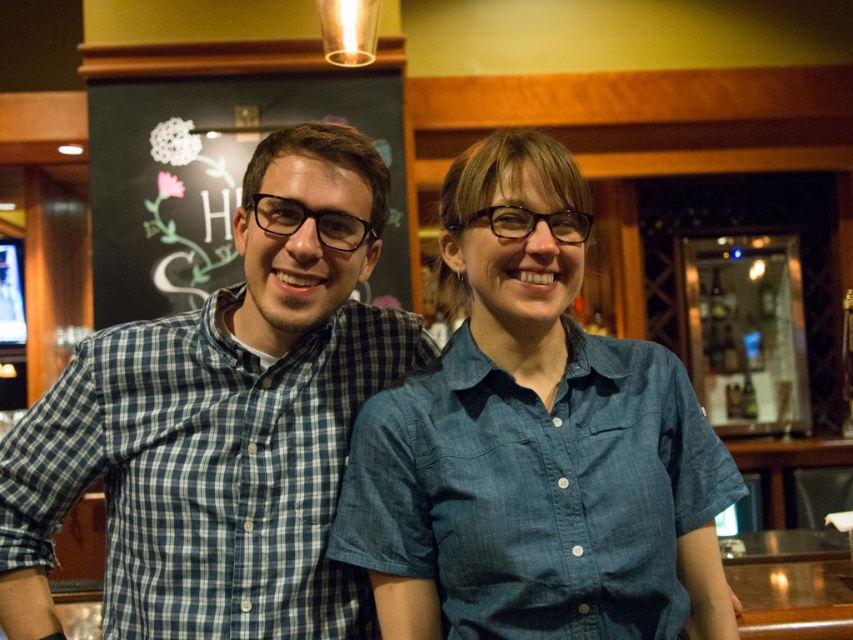
Looking at this image, you are a photographer trying to capture a group photo of the two people in the scene. The denim shirt at center is narrower than the black chalkboard at upper left. To ensure both subjects are framed properly, which object should you adjust your camera angle to focus on first?

The denim shirt at center is narrower than the black chalkboard at upper left, so you should focus on the denim shirt at center first to ensure proper framing since it requires less space in the frame.

Looking at this image, you are standing in the dining area and want to move from point A to point B. If point A is at point (x=393, y=595) and point B is at point (x=247, y=352), which direction should you move to get closer to point B?

To move from point A at (x=393, y=595) to point B at (x=247, y=352), you should move towards the left and downward since point A is in front of point B, meaning it is closer to the viewer. Moving left and down would align with the coordinates decreasing in both x and y directions.

You are standing in the casual dining or bar setting shown in the image. You need to move from your current position to a point that is behind both the point at coordinates (84, 412) and the point at (206, 102). Which point should you use as your reference to ensure you are positioned correctly?

To be behind both points, you should position yourself behind the point at coordinates (206, 102) because point (84, 412) is in front of it. Since point (206, 102) is further back, being behind it will also place you behind the other point.